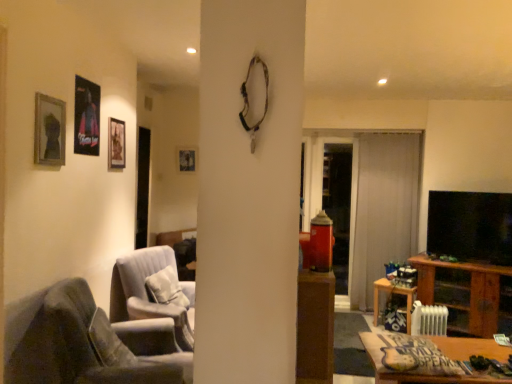
I want to click on vacant point above white sheer curtain at center (from a real-world perspective), so click(x=389, y=131).